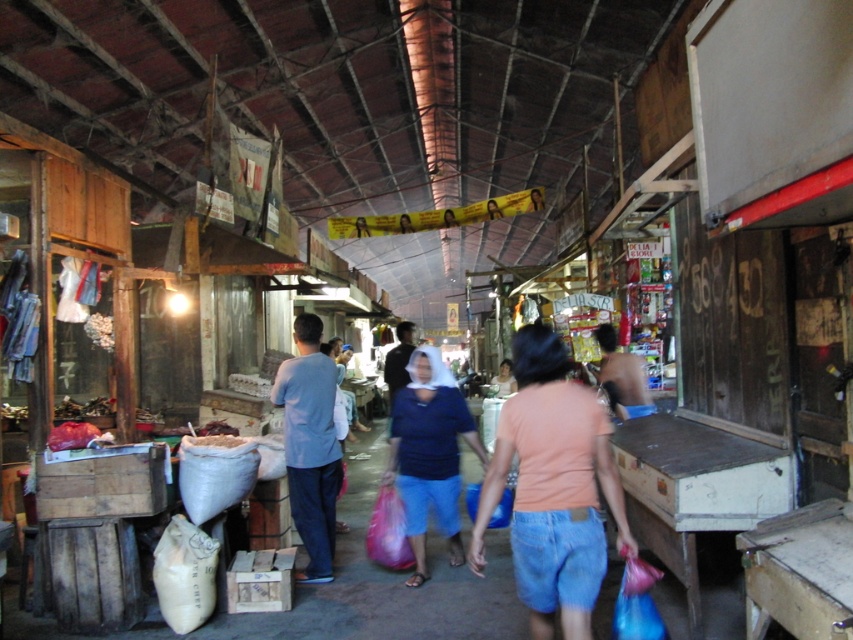
You are a customer at the market and want to know which item is shorter between the denim shorts at center and the light blue fabric shirt at center. Can you help?

The denim shorts at center has a lesser height compared to the light blue fabric shirt at center, so the denim shorts at center is shorter.

You are standing at the entrance of the market and see the blue cotton shirt at center. If you want to reach the shirt, how many steps would you need to take if each step is 2 feet long?

The distance between you and the blue cotton shirt at center is 17.07 feet. Since each step is 2 feet, you would need approximately 9 steps to reach it.

You are a customer in the market and want to buy a pair of shorts and a shirt. You have a backpack that can only fit items narrower than 30 cm. Based on the items available, will both the denim shorts at center and the blue cotton shirt at center fit into your backpack?

The denim shorts at center has a width less than the blue cotton shirt at center. However, since the blue cotton shirt at center is wider than the denim shorts, and we don not know the exact width of the shirt, it is possible that the shirt may exceed the 30 cm limit. Therefore, only the denim shorts at center can be certain to fit, but the blue cotton shirt at center might not fit depending on its actual width.